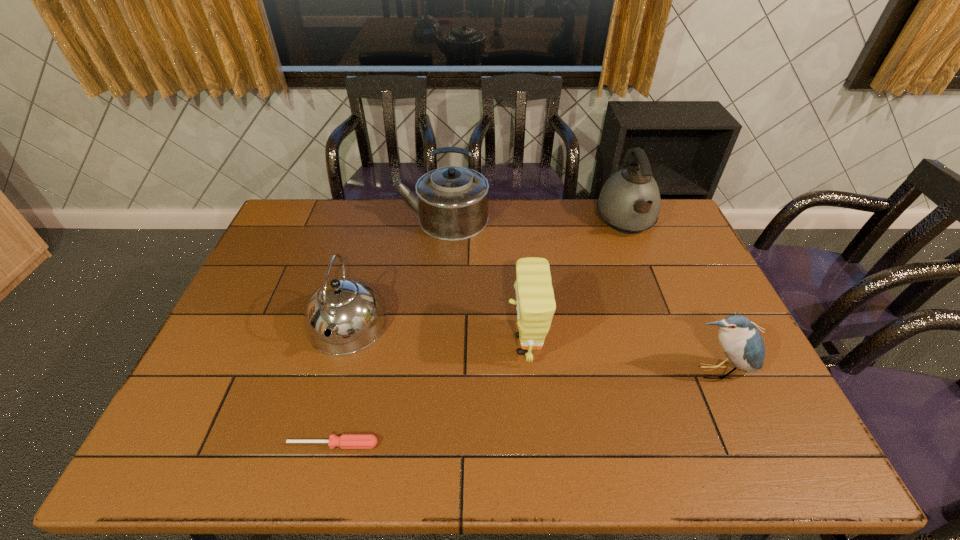
Identify the location of free point located 0.120m from the spout of the nearest kettle. (324, 403).

At what (x,y) coordinates should I click in order to perform the action: click on vacant space located 0.100m at the tip of the bird's beak. Please return your answer as a coordinate pair (x, y). This screenshot has height=540, width=960. Looking at the image, I should click on (738, 422).

At what (x,y) coordinates should I click in order to perform the action: click on vacant space located on the back of the screwdriver. Please return your answer as a coordinate pair (x, y). This screenshot has width=960, height=540. Looking at the image, I should click on (362, 327).

Where is `object that is at the near edge`? object that is at the near edge is located at coordinates (346, 441).

Identify the location of kettle present at the right edge. (629, 202).

Where is `bird that is positioned at the right edge`? The width and height of the screenshot is (960, 540). bird that is positioned at the right edge is located at coordinates (742, 343).

Find the location of a particular element. This screenshot has height=540, width=960. object at the far right corner is located at coordinates (629, 202).

Where is `vacant space at the far edge`? vacant space at the far edge is located at coordinates (554, 211).

Where is `vacant space at the left edge of the desktop`? The image size is (960, 540). vacant space at the left edge of the desktop is located at coordinates (304, 268).

Locate an element on the screen. The image size is (960, 540). vacant area at the right edge is located at coordinates (703, 371).